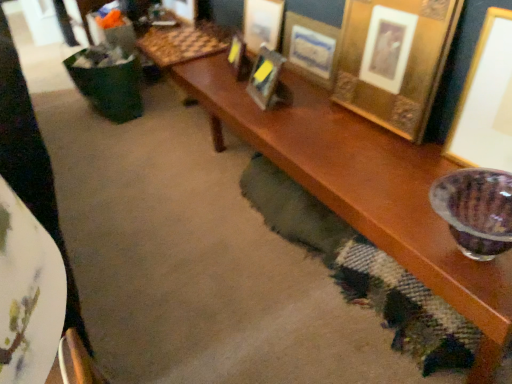
Question: In which direction should I rotate to look at gold metallic picture frame at upper center, which ranks as the 6th picture frame in right-to-left order?

Choices:
 (A) left
 (B) right

Answer: (A)

Question: Does gold metallic picture frame at upper center, the 1th picture frame when ordered from left to right, have a larger size compared to gold metallic picture frame at upper center, which appears as the 5th picture frame when viewed from the right?

Choices:
 (A) yes
 (B) no

Answer: (B)

Question: From the image's perspective, is gold metallic picture frame at upper center, which ranks as the 6th picture frame in right-to-left order, located above gold metallic picture frame at upper center, arranged as the second picture frame when viewed from the left?

Choices:
 (A) yes
 (B) no

Answer: (B)

Question: Does gold metallic picture frame at upper center, which ranks as the 6th picture frame in right-to-left order, have a greater height compared to gold metallic picture frame at upper center, which appears as the 5th picture frame when viewed from the right?

Choices:
 (A) no
 (B) yes

Answer: (A)

Question: Is gold metallic picture frame at upper center, the 1th picture frame when ordered from left to right, in contact with gold metallic picture frame at upper center, arranged as the second picture frame when viewed from the left?

Choices:
 (A) yes
 (B) no

Answer: (B)

Question: Is the position of gold metallic picture frame at upper center, which ranks as the 6th picture frame in right-to-left order, more distant than that of gold metallic picture frame at upper center, arranged as the second picture frame when viewed from the left?

Choices:
 (A) no
 (B) yes

Answer: (A)

Question: Is gold metallic picture frame at upper center, the 1th picture frame when ordered from left to right, looking in the opposite direction of gold metallic picture frame at upper center, arranged as the second picture frame when viewed from the left?

Choices:
 (A) yes
 (B) no

Answer: (A)

Question: Does gold metallic picture frame at upper center, the 4th picture frame in the right-to-left sequence, have a lesser width compared to white fabric at lower left?

Choices:
 (A) yes
 (B) no

Answer: (A)

Question: Are gold metallic picture frame at upper center, arranged as the third picture frame when viewed from the left, and white fabric at lower left beside each other?

Choices:
 (A) yes
 (B) no

Answer: (B)

Question: Is gold metallic picture frame at upper center, the 4th picture frame in the right-to-left sequence, taller than white fabric at lower left?

Choices:
 (A) no
 (B) yes

Answer: (A)

Question: Is the position of gold metallic picture frame at upper center, the 4th picture frame in the right-to-left sequence, more distant than that of white fabric at lower left?

Choices:
 (A) yes
 (B) no

Answer: (A)

Question: From the image's perspective, is gold metallic picture frame at upper center, arranged as the third picture frame when viewed from the left, below white fabric at lower left?

Choices:
 (A) yes
 (B) no

Answer: (B)

Question: Is gold metallic picture frame at upper center, the 4th picture frame in the right-to-left sequence, positioned in front of white fabric at lower left?

Choices:
 (A) no
 (B) yes

Answer: (A)

Question: From the image's perspective, is gold metallic picture frame at upper center, the 1th picture frame when ordered from left to right, over gold metallic picture frame at upper center, the 4th picture frame in the right-to-left sequence?

Choices:
 (A) no
 (B) yes

Answer: (B)